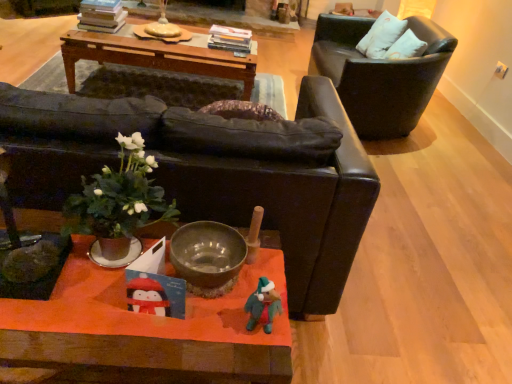
The width and height of the screenshot is (512, 384). In order to click on vacant area that lies in front of metallic silver bowl at center in this screenshot , I will do `click(184, 342)`.